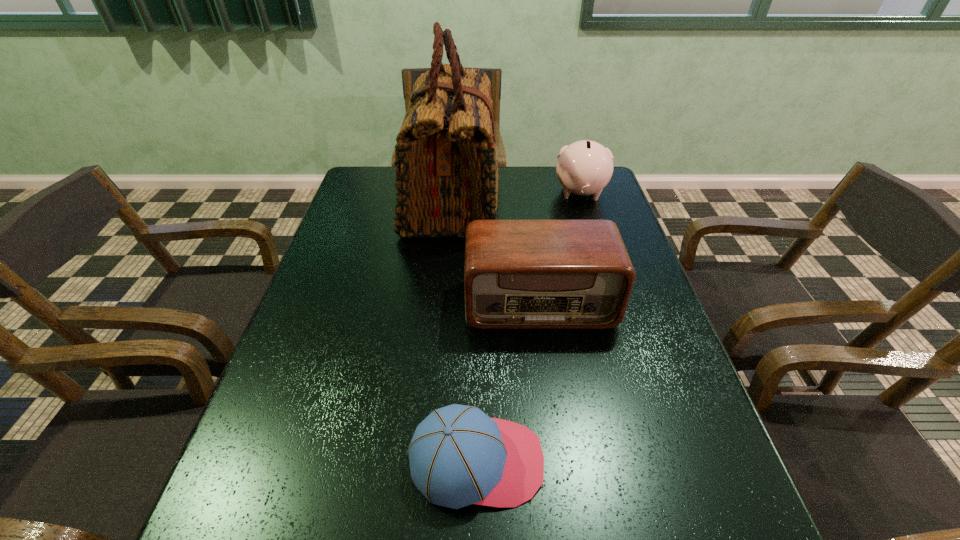
Where is `shopping bag`? shopping bag is located at coordinates (446, 169).

You are a GUI agent. You are given a task and a screenshot of the screen. Output one action in this format:
    pyautogui.click(x=<x>, y=<y>)
    Task: Click on the second nearest object
    This screenshot has width=960, height=540.
    Given the screenshot: What is the action you would take?
    pyautogui.click(x=518, y=274)

The width and height of the screenshot is (960, 540). In order to click on piggy bank in this screenshot , I will do `click(585, 167)`.

At what (x,y) coordinates should I click in order to perform the action: click on the nearest object. Please return your answer as a coordinate pair (x, y). Looking at the image, I should click on (458, 456).

Find the location of a particular element. The image size is (960, 540). the shortest object is located at coordinates (458, 456).

You are a GUI agent. You are given a task and a screenshot of the screen. Output one action in this format:
    pyautogui.click(x=<x>, y=<y>)
    Task: Click on the free space located on the open handle side of the tallest object
    The height and width of the screenshot is (540, 960).
    Given the screenshot: What is the action you would take?
    (x=539, y=202)

Find the location of a particular element. vacant space located 0.320m on the front panel of the radio receiver is located at coordinates (563, 465).

Identify the location of vacant space located on the left of the piggy bank. (485, 193).

Find the location of a particular element. Image resolution: width=960 pixels, height=540 pixels. free region located on the front-facing side of the nearest object is located at coordinates (610, 462).

Identify the location of shopping bag located in the far edge section of the desktop. The image size is (960, 540). (446, 169).